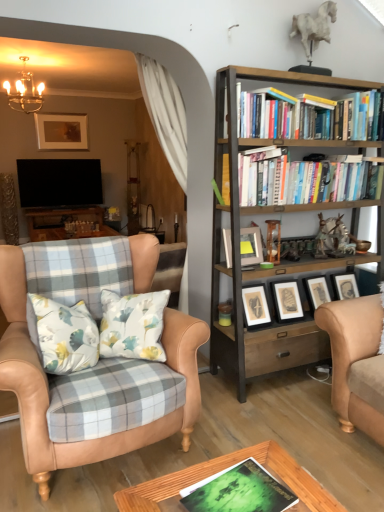
Where is `free space above green matte book at center, which is the 1th book in bottom-to-top order (from a real-world perspective)`? The width and height of the screenshot is (384, 512). free space above green matte book at center, which is the 1th book in bottom-to-top order (from a real-world perspective) is located at coordinates (247, 488).